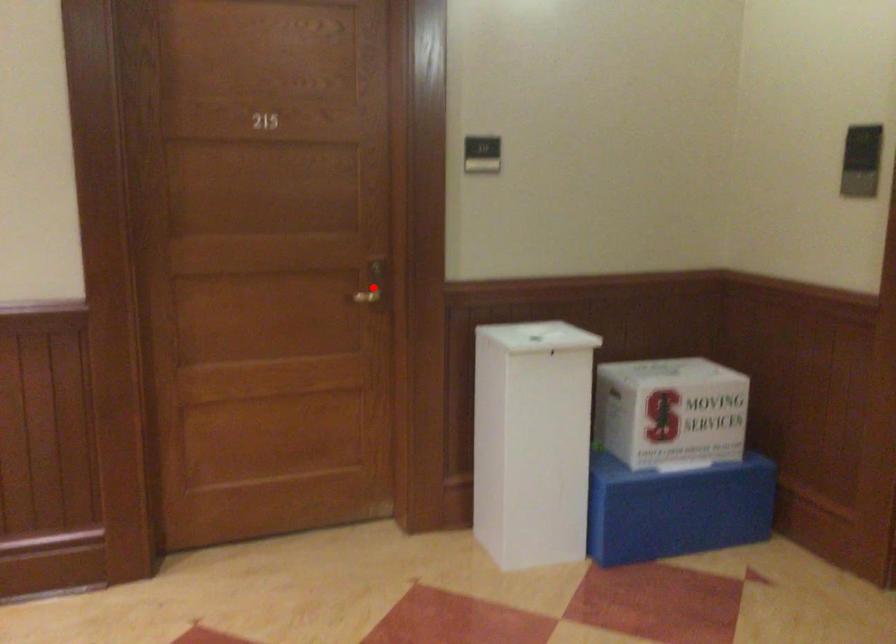
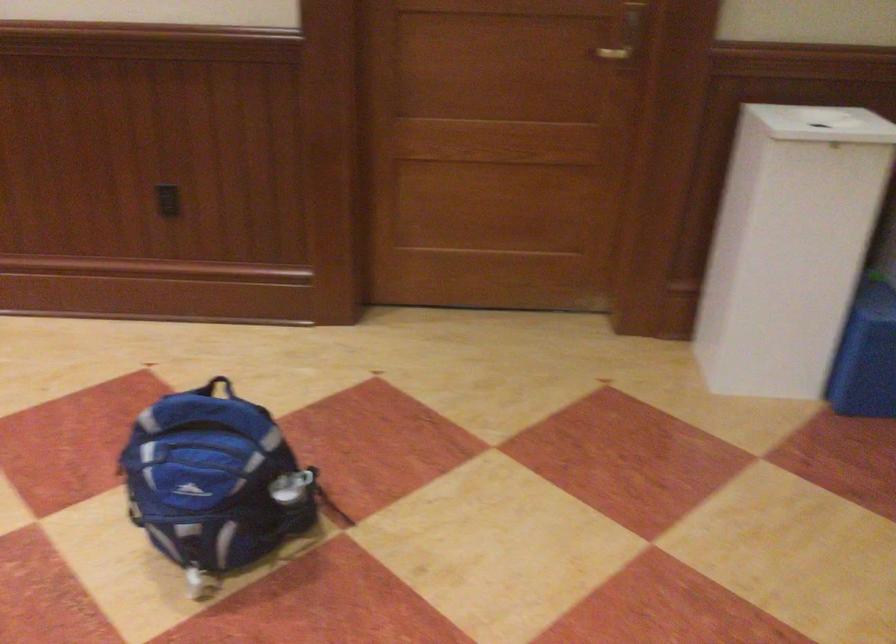
Question: I am providing you with two images of the same scene from different viewpoints. A red point is shown in image1. For the corresponding object point in image2, is it positioned nearer or farther from the camera?

Choices:
 (A) Nearer
 (B) Farther

Answer: (A)